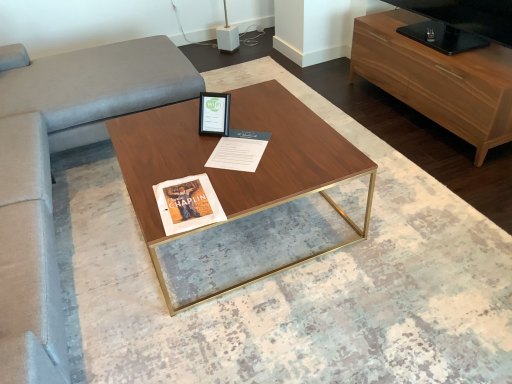
Where is `vacant area that lies in front of white paper at center`? This screenshot has width=512, height=384. vacant area that lies in front of white paper at center is located at coordinates pyautogui.click(x=239, y=180).